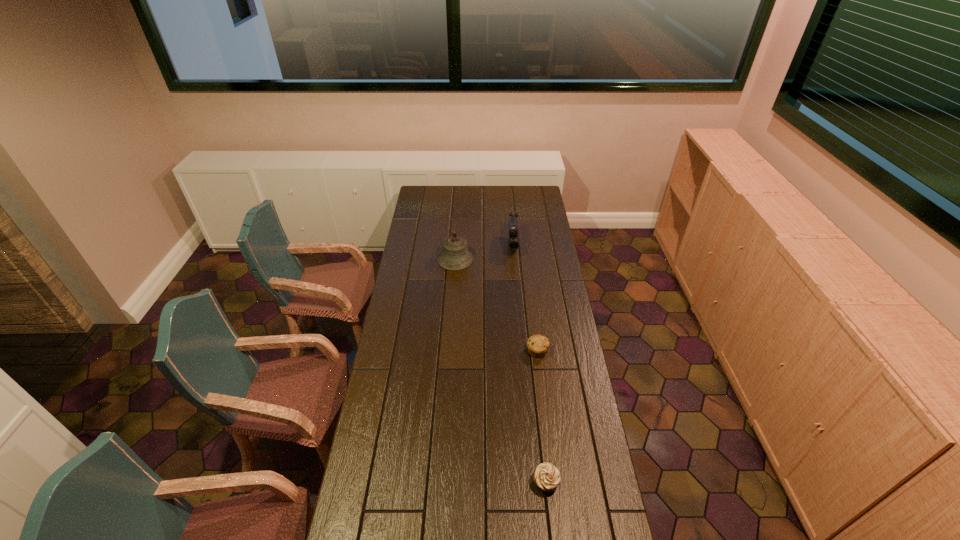
Identify the location of empty space that is in between the second nearest object and the camcorder. The height and width of the screenshot is (540, 960). (525, 299).

At what (x,y) coordinates should I click in order to perform the action: click on object that can be found as the second closest to the nearer muffin. Please return your answer as a coordinate pair (x, y). The width and height of the screenshot is (960, 540). Looking at the image, I should click on (455, 256).

Locate an element on the screen. object that stands as the third closest to the bell is located at coordinates (546, 476).

This screenshot has height=540, width=960. I want to click on blank area in the image that satisfies the following two spatial constraints: 1. on the front side of the bell; 2. on the right side of the farther muffin, so click(x=449, y=351).

Find the location of a particular element. The image size is (960, 540). vacant space that satisfies the following two spatial constraints: 1. on the front-facing side of the nearer muffin; 2. on the left side of the camcorder is located at coordinates (535, 482).

Locate an element on the screen. This screenshot has width=960, height=540. vacant space that satisfies the following two spatial constraints: 1. on the front-facing side of the nearest object; 2. on the right side of the camcorder is located at coordinates (535, 482).

This screenshot has height=540, width=960. Find the location of `vacant space that satisfies the following two spatial constraints: 1. on the back side of the nearest object; 2. on the right side of the third farthest object`. vacant space that satisfies the following two spatial constraints: 1. on the back side of the nearest object; 2. on the right side of the third farthest object is located at coordinates (531, 351).